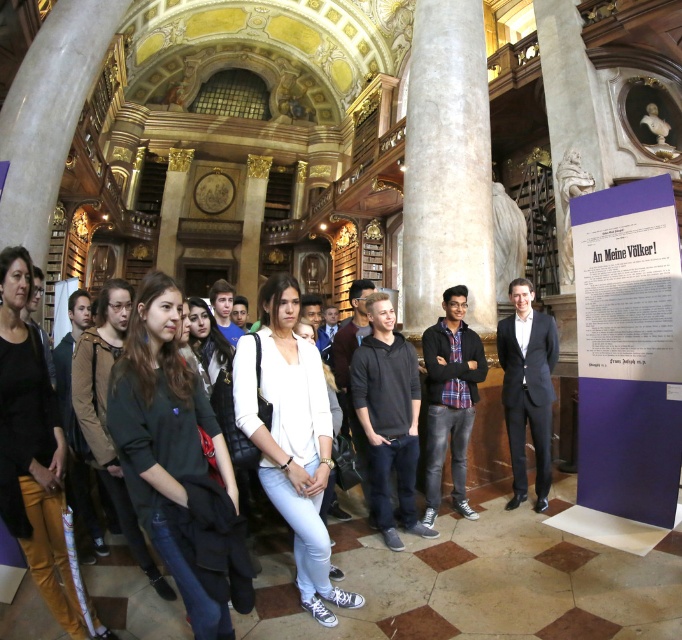
Question: Among these points, which one is nearest to the camera?

Choices:
 (A) (429, 426)
 (B) (486, 90)
 (C) (642, 371)
 (D) (507, 392)

Answer: (C)

Question: Considering the relative positions of white marble pillar at center and black cotton jacket at center in the image provided, where is white marble pillar at center located with respect to black cotton jacket at center?

Choices:
 (A) below
 (B) above

Answer: (B)

Question: Is white marble pillar at center positioned in front of plaid fabric shirt at center?

Choices:
 (A) yes
 (B) no

Answer: (B)

Question: Which is farther from the purple paper at center?

Choices:
 (A) dark blue suit at right
 (B) white marble statue at upper right
 (C) white marble pillar at center

Answer: (B)

Question: Can you confirm if black cotton jacket at center is positioned above white marble statue at upper right?

Choices:
 (A) no
 (B) yes

Answer: (A)

Question: Based on their relative distances, which object is nearer to the dark blue suit at right?

Choices:
 (A) white marble pillar at center
 (B) white marble statue at upper right
 (C) purple paper at center
 (D) black cotton jacket at center

Answer: (C)